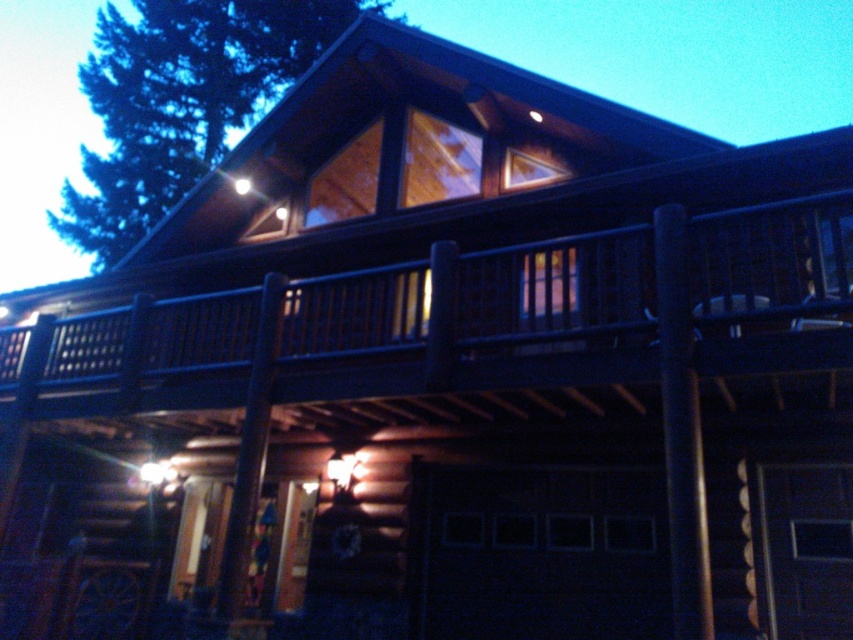
Question: Can you confirm if dark wood porch at upper center is positioned to the left of green leafy tree at upper left?

Choices:
 (A) no
 (B) yes

Answer: (A)

Question: Is dark wood porch at upper center smaller than green leafy tree at upper left?

Choices:
 (A) yes
 (B) no

Answer: (A)

Question: Among these objects, which one is nearest to the camera?

Choices:
 (A) green leafy tree at upper left
 (B) dark wood porch at upper center

Answer: (B)

Question: Which point is farther to the camera?

Choices:
 (A) green leafy tree at upper left
 (B) dark wood porch at upper center

Answer: (A)

Question: Can you confirm if dark wood porch at upper center is positioned to the left of green leafy tree at upper left?

Choices:
 (A) no
 (B) yes

Answer: (A)